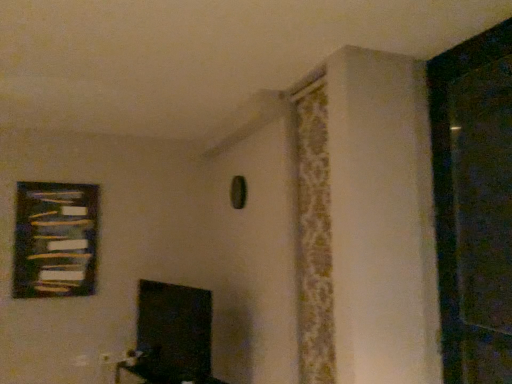
What do you see at coordinates (314, 234) in the screenshot? I see `patterned fabric curtain at upper right` at bounding box center [314, 234].

The image size is (512, 384). What do you see at coordinates (474, 204) in the screenshot? I see `black matte screen door at right` at bounding box center [474, 204].

You are a GUI agent. You are given a task and a screenshot of the screen. Output one action in this format:
    pyautogui.click(x=<x>, y=<y>)
    Task: Click on the matte black tv at lower center
    The width and height of the screenshot is (512, 384).
    Given the screenshot: What is the action you would take?
    pyautogui.click(x=161, y=371)

Based on the photo, looking at the image, does matte black tv at lower center seem bigger or smaller compared to patterned fabric curtain at upper right?

matte black tv at lower center is bigger than patterned fabric curtain at upper right.

Which object is wider, matte black tv at lower center or patterned fabric curtain at upper right?

matte black tv at lower center is wider.

From a real-world perspective, is matte black tv at lower center on top of patterned fabric curtain at upper right?

No.

Is matte black tv at lower center positioned with its back to patterned fabric curtain at upper right?

No, matte black tv at lower center is not facing the opposite direction of patterned fabric curtain at upper right.

At what (x,y) coordinates should I click in order to perform the action: click on curtain that is above the wooden frame at upper left (from the image's perspective). Please return your answer as a coordinate pair (x, y). The width and height of the screenshot is (512, 384). Looking at the image, I should click on (314, 234).

From a real-world perspective, is patterned fabric curtain at upper right on top of wooden frame at upper left?

Yes, from a real-world perspective, patterned fabric curtain at upper right is over wooden frame at upper left

Is wooden frame at upper left at the back of patterned fabric curtain at upper right?

That's not correct — patterned fabric curtain at upper right is not looking away from wooden frame at upper left.

Looking at this image, which of these two, patterned fabric curtain at upper right or wooden frame at upper left, is thinner?

With smaller width is wooden frame at upper left.

Which of these two, matte black tv at lower center or black matte screen door at right, is bigger?

matte black tv at lower center.

This screenshot has width=512, height=384. I want to click on screen door lying above the matte black tv at lower center (from the image's perspective), so click(x=474, y=204).

Which object is further away from the camera, matte black tv at lower center or black matte screen door at right?

matte black tv at lower center is further away from the camera.

Is matte black tv at lower center touching black matte screen door at right?

matte black tv at lower center is not next to black matte screen door at right, and they're not touching.

In the scene shown: From their relative heights in the image, would you say wooden frame at upper left is taller or shorter than matte black tv at lower center?

In the image, wooden frame at upper left appears to be taller than matte black tv at lower center.

Which of these two, wooden frame at upper left or matte black tv at lower center, is wider?

Wider between the two is matte black tv at lower center.

Does wooden frame at upper left lie in front of matte black tv at lower center?

No.

Who is smaller, wooden frame at upper left or matte black tv at lower center?

With smaller size is wooden frame at upper left.

What are the coordinates of `furniture to the left of patterned fabric curtain at upper right` in the screenshot? It's located at (161, 371).

Can you confirm if patterned fabric curtain at upper right is thinner than matte black tv at lower center?

Yes, patterned fabric curtain at upper right is thinner than matte black tv at lower center.

From the image's perspective, is patterned fabric curtain at upper right over matte black tv at lower center?

Yes, from the image's perspective, patterned fabric curtain at upper right is above matte black tv at lower center.

Is black matte screen door at right situated inside matte black tv at lower center or outside?

black matte screen door at right is not enclosed by matte black tv at lower center.

In the scene shown: Does black matte screen door at right have a greater height compared to matte black tv at lower center?

Correct, black matte screen door at right is much taller as matte black tv at lower center.

Is black matte screen door at right closer to the viewer compared to matte black tv at lower center?

Yes, it is.

Considering the relative positions of black matte screen door at right and patterned fabric curtain at upper right in the image provided, is black matte screen door at right to the left of patterned fabric curtain at upper right from the viewer's perspective?

Incorrect, black matte screen door at right is not on the left side of patterned fabric curtain at upper right.

Can you confirm if black matte screen door at right is taller than patterned fabric curtain at upper right?

Incorrect, the height of black matte screen door at right is not larger of that of patterned fabric curtain at upper right.

Which object is thinner, black matte screen door at right or patterned fabric curtain at upper right?

Answer: patterned fabric curtain at upper right.

Locate an element on the screen. curtain that appears in front of the matte black tv at lower center is located at coordinates (314, 234).

In the image, there is a patterned fabric curtain at upper right. Find the location of `picture frame below it (from the image's perspective)`. picture frame below it (from the image's perspective) is located at coordinates (55, 240).

Estimate the real-world distances between objects in this image. Which object is closer to black matte screen door at right, matte black tv at lower center or patterned fabric curtain at upper right?

The object closer to black matte screen door at right is patterned fabric curtain at upper right.

Looking at this image, when comparing their distances from wooden frame at upper left, does matte black tv at lower center or black matte screen door at right seem further?

black matte screen door at right is further to wooden frame at upper left.

When comparing their distances from patterned fabric curtain at upper right, does matte black tv at lower center or black matte screen door at right seem further?

Among the two, matte black tv at lower center is located further to patterned fabric curtain at upper right.

Considering their positions, is wooden frame at upper left positioned closer to matte black tv at lower center than black matte screen door at right?

wooden frame at upper left is closer to matte black tv at lower center.

Looking at the image, which one is located further to patterned fabric curtain at upper right, wooden frame at upper left or black matte screen door at right?

wooden frame at upper left.

Estimate the real-world distances between objects in this image. Which object is closer to black matte screen door at right, matte black tv at lower center or wooden frame at upper left?

matte black tv at lower center.

Looking at the image, which one is located closer to matte black tv at lower center, wooden frame at upper left or patterned fabric curtain at upper right?

wooden frame at upper left is positioned closer to the anchor matte black tv at lower center.

Which object lies further to the anchor point matte black tv at lower center, black matte screen door at right or wooden frame at upper left?

Among the two, black matte screen door at right is located further to matte black tv at lower center.

Find the location of a particular element. Image resolution: width=512 pixels, height=384 pixels. curtain between matte black tv at lower center and black matte screen door at right is located at coordinates (x=314, y=234).

Identify the location of curtain between wooden frame at upper left and black matte screen door at right in the horizontal direction. (314, 234).

Identify the location of furniture between wooden frame at upper left and patterned fabric curtain at upper right. The width and height of the screenshot is (512, 384). (161, 371).

This screenshot has height=384, width=512. What are the coordinates of `furniture between wooden frame at upper left and black matte screen door at right` in the screenshot? It's located at (161, 371).